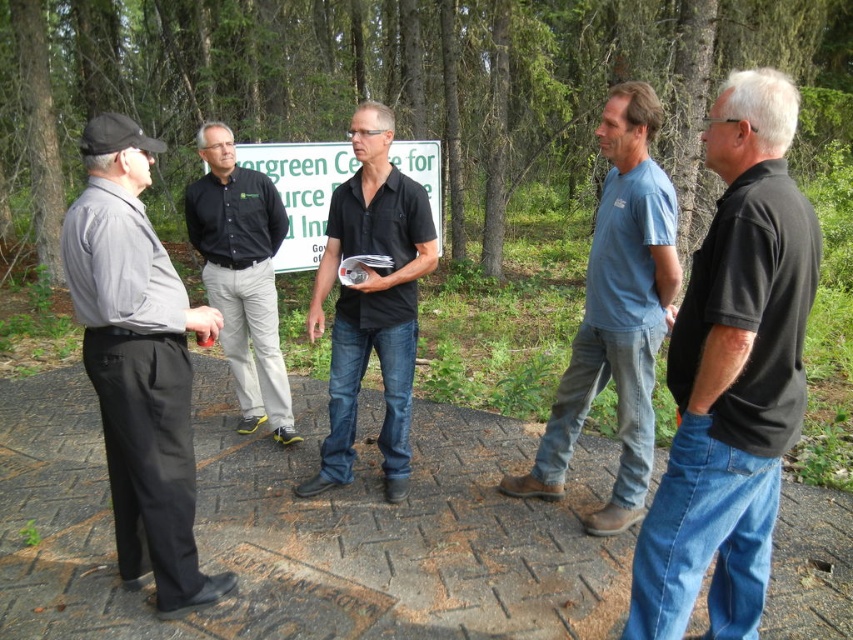
Question: Which object appears farthest from the camera in this image?

Choices:
 (A) blue cotton shirt at center
 (B) gray matte shirt at left

Answer: (A)

Question: Which object is the closest to the green plastic sign at center?

Choices:
 (A) black smooth shirt at center
 (B) black cotton polo shirt at center
 (C) gray matte shirt at left

Answer: (A)

Question: Is gray matte shirt at left to the left of blue cotton shirt at center from the viewer's perspective?

Choices:
 (A) no
 (B) yes

Answer: (B)

Question: Does blue cotton shirt at center come behind black smooth shirt at center?

Choices:
 (A) yes
 (B) no

Answer: (B)

Question: Which point is farther from the camera taking this photo?

Choices:
 (A) (271, 227)
 (B) (148, 481)
 (C) (554, 451)
 (D) (434, 236)

Answer: (A)

Question: Does black cotton polo shirt at center appear under black matte shirt at center?

Choices:
 (A) yes
 (B) no

Answer: (A)